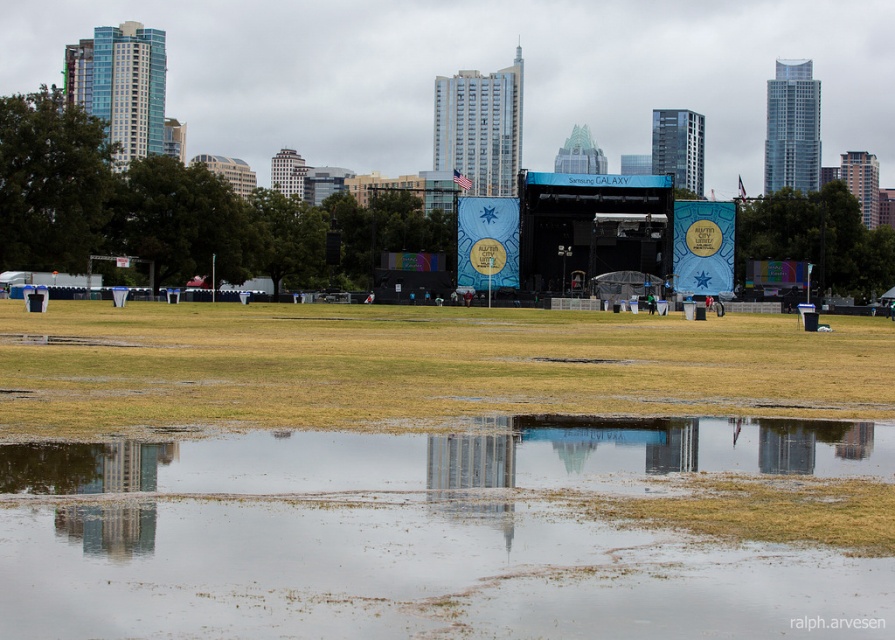
You are a photographer standing at the edge of the field, aiming to capture a shot of the stage in the background. You notice transparent water at lower center and brown grass at lower center. Considering the distance between them, which surface would allow you to place your tripod without obstructing the view of the stage?

The transparent water at lower center and brown grass at lower center are 24.94 meters apart. To avoid obstructing the view of the stage, you should place the tripod on the brown grass at lower center since it is closer to the photographer and less likely to block the background.

You are a photographer trying to capture the stage in the background. You notice transparent water at lower center and brown grass at lower center in the foreground. Which surface should you avoid stepping on to prevent blurring your shot?

You should avoid stepping on the transparent water at lower center because it is thinner than the brown grass at lower center, making it less stable and more likely to cause blurring from movement.